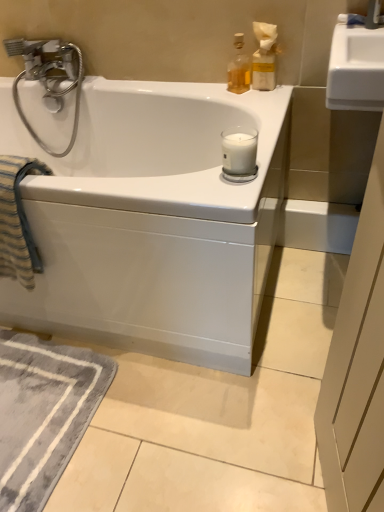
In the scene shown: In order to face translucent glass bottle at upper right, arranged as the 2th bottle when viewed from the right, should I rotate leftwards or rightwards?

A 6.355 degree turn to the right will do.

Where is `white matte glass candle at upper right`? white matte glass candle at upper right is located at coordinates (239, 151).

Image resolution: width=384 pixels, height=512 pixels. What do you see at coordinates (264, 57) in the screenshot?
I see `translucent glass bottle at upper right, the 2th bottle in the left-to-right sequence` at bounding box center [264, 57].

You are a GUI agent. You are given a task and a screenshot of the screen. Output one action in this format:
    pyautogui.click(x=<x>, y=<y>)
    Task: Click on the white glossy bathtub at center
    
    Given the screenshot: What is the action you would take?
    [152, 220]

Looking at this image, from the image's perspective, which one is positioned lower, translucent glass bottle at upper right, arranged as the 2th bottle when viewed from the right, or white matte glass candle at upper right?

white matte glass candle at upper right appears lower in the image.

From the picture: Measure the distance between translucent glass bottle at upper right, arranged as the 2th bottle when viewed from the right, and white matte glass candle at upper right.

translucent glass bottle at upper right, arranged as the 2th bottle when viewed from the right, and white matte glass candle at upper right are 16.72 inches apart.

Considering the sizes of objects translucent glass bottle at upper right, acting as the first bottle starting from the left, and white matte glass candle at upper right in the image provided, who is wider, translucent glass bottle at upper right, acting as the first bottle starting from the left, or white matte glass candle at upper right?

white matte glass candle at upper right is wider.

Consider the image. Between translucent glass bottle at upper right, arranged as the 2th bottle when viewed from the right, and white matte glass candle at upper right, which one appears on the right side from the viewer's perspective?

translucent glass bottle at upper right, arranged as the 2th bottle when viewed from the right, is more to the right.

Considering the points (247, 77) and (25, 259), which point is behind, point (247, 77) or point (25, 259)?

Point (247, 77)

Considering the relative positions of translucent glass bottle at upper right, arranged as the 2th bottle when viewed from the right, and striped cotton beach towel at left in the image provided, is translucent glass bottle at upper right, arranged as the 2th bottle when viewed from the right, to the left of striped cotton beach towel at left from the viewer's perspective?

No, translucent glass bottle at upper right, arranged as the 2th bottle when viewed from the right, is not to the left of striped cotton beach towel at left.

From a real-world perspective, is translucent glass bottle at upper right, acting as the first bottle starting from the left, on striped cotton beach towel at left?

Correct, in the physical world, translucent glass bottle at upper right, acting as the first bottle starting from the left, is higher than striped cotton beach towel at left.

Between translucent glass bottle at upper right, acting as the first bottle starting from the left, and gray soft rug at lower left, which one has larger size?

gray soft rug at lower left.

Is translucent glass bottle at upper right, arranged as the 2th bottle when viewed from the right, far away from gray soft rug at lower left?

translucent glass bottle at upper right, arranged as the 2th bottle when viewed from the right, is positioned a significant distance from gray soft rug at lower left.

Between translucent glass bottle at upper right, acting as the first bottle starting from the left, and gray soft rug at lower left, which one has less height?

With less height is gray soft rug at lower left.

From the image's perspective, is translucent glass bottle at upper right, acting as the first bottle starting from the left, under gray soft rug at lower left?

No.

Is striped cotton beach towel at left not near translucent glass bottle at upper right, acting as the first bottle starting from the left?

No, striped cotton beach towel at left is not far away from translucent glass bottle at upper right, acting as the first bottle starting from the left.

Who is taller, striped cotton beach towel at left or translucent glass bottle at upper right, arranged as the 2th bottle when viewed from the right?

striped cotton beach towel at left.

Based on the photo, how distant is striped cotton beach towel at left from translucent glass bottle at upper right, acting as the first bottle starting from the left?

The distance of striped cotton beach towel at left from translucent glass bottle at upper right, acting as the first bottle starting from the left, is 30.80 inches.

Considering the sizes of striped cotton beach towel at left and translucent glass bottle at upper right, acting as the first bottle starting from the left, in the image, is striped cotton beach towel at left wider or thinner than translucent glass bottle at upper right, acting as the first bottle starting from the left,?

Clearly, striped cotton beach towel at left has more width compared to translucent glass bottle at upper right, acting as the first bottle starting from the left.

Between point (12, 202) and point (243, 137), which one is positioned behind?

The point (12, 202) is farther.

Find the location of a particular element. beach towel below the white matte glass candle at upper right (from the image's perspective) is located at coordinates (17, 221).

Considering the sizes of objects striped cotton beach towel at left and white matte glass candle at upper right in the image provided, who is shorter, striped cotton beach towel at left or white matte glass candle at upper right?

white matte glass candle at upper right is shorter.

Can you tell me how much striped cotton beach towel at left and white matte glass candle at upper right differ in facing direction?

1.85 degrees separate the facing orientations of striped cotton beach towel at left and white matte glass candle at upper right.

Is white matte glass candle at upper right not near translucent glass bottle at upper right, acting as the first bottle starting from the left?

That's not correct — white matte glass candle at upper right is a little close to translucent glass bottle at upper right, acting as the first bottle starting from the left.

Consider the image. From the image's perspective, is white matte glass candle at upper right positioned above or below translucent glass bottle at upper right, acting as the first bottle starting from the left?

Based on their image positions, white matte glass candle at upper right is located beneath translucent glass bottle at upper right, acting as the first bottle starting from the left.

Is translucent glass bottle at upper right, acting as the first bottle starting from the left, located within white matte glass candle at upper right?

That's incorrect, translucent glass bottle at upper right, acting as the first bottle starting from the left, is not inside white matte glass candle at upper right.

In terms of size, does white matte glass candle at upper right appear bigger or smaller than translucent glass bottle at upper right, acting as the first bottle starting from the left?

Clearly, white matte glass candle at upper right is smaller in size than translucent glass bottle at upper right, acting as the first bottle starting from the left.

Is the depth of striped cotton beach towel at left greater than that of gray soft rug at lower left?

No.

Is striped cotton beach towel at left taller or shorter than gray soft rug at lower left?

Clearly, striped cotton beach towel at left is taller compared to gray soft rug at lower left.

Is striped cotton beach towel at left to the left of gray soft rug at lower left from the viewer's perspective?

Correct, you'll find striped cotton beach towel at left to the left of gray soft rug at lower left.

Which of these two, striped cotton beach towel at left or gray soft rug at lower left, is wider?

With larger width is gray soft rug at lower left.

Locate an element on the screen. candle on the left of translucent glass bottle at upper right, arranged as the 2th bottle when viewed from the right is located at coordinates (239, 151).

This screenshot has width=384, height=512. Find the location of `beach towel below the translucent glass bottle at upper right, acting as the first bottle starting from the left (from a real-world perspective)`. beach towel below the translucent glass bottle at upper right, acting as the first bottle starting from the left (from a real-world perspective) is located at coordinates (17, 221).

Looking at the image, which one is located closer to striped cotton beach towel at left, white glossy bathtub at center or translucent glass bottle at upper right, acting as the first bottle starting from the left?

white glossy bathtub at center lies closer to striped cotton beach towel at left than the other object.

From the image, which object appears to be nearer to striped cotton beach towel at left, white glossy bathtub at center or gray soft rug at lower left?

Among the two, white glossy bathtub at center is located nearer to striped cotton beach towel at left.

Considering their positions, is gray soft rug at lower left positioned further to white glossy bathtub at center than striped cotton beach towel at left?

Based on the image, gray soft rug at lower left appears to be further to white glossy bathtub at center.

Which object lies nearer to the anchor point white matte glass candle at upper right, white glossy bathtub at center or translucent glass bottle at upper right, arranged as the 2th bottle when viewed from the right?

translucent glass bottle at upper right, arranged as the 2th bottle when viewed from the right, is positioned closer to the anchor white matte glass candle at upper right.

Considering their positions, is translucent glass bottle at upper right, acting as the first bottle starting from the left, positioned further to white matte glass candle at upper right than gray soft rug at lower left?

gray soft rug at lower left is further to white matte glass candle at upper right.

When comparing their distances from gray soft rug at lower left, does white glossy bathtub at center or white matte glass candle at upper right seem closer?

The object closer to gray soft rug at lower left is white glossy bathtub at center.

Estimate the real-world distances between objects in this image. Which object is closer to translucent glass bottle at upper right, which is the first bottle from right to left, striped cotton beach towel at left or gray soft rug at lower left?

striped cotton beach towel at left is closer to translucent glass bottle at upper right, which is the first bottle from right to left.

When comparing their distances from white matte glass candle at upper right, does gray soft rug at lower left or translucent glass bottle at upper right, arranged as the 2th bottle when viewed from the right, seem further?

Based on the image, gray soft rug at lower left appears to be further to white matte glass candle at upper right.

Identify the location of bathtub between translucent glass bottle at upper right, the 2th bottle in the left-to-right sequence, and gray soft rug at lower left vertically. This screenshot has width=384, height=512. (152, 220).

Find the location of a particular element. beach towel between translucent glass bottle at upper right, the 2th bottle in the left-to-right sequence, and gray soft rug at lower left from top to bottom is located at coordinates (17, 221).

The width and height of the screenshot is (384, 512). I want to click on bottle situated between striped cotton beach towel at left and translucent glass bottle at upper right, which is the first bottle from right to left, from left to right, so click(x=239, y=68).

This screenshot has width=384, height=512. In order to click on bathtub between striped cotton beach towel at left and translucent glass bottle at upper right, arranged as the 2th bottle when viewed from the right in this screenshot , I will do `click(152, 220)`.